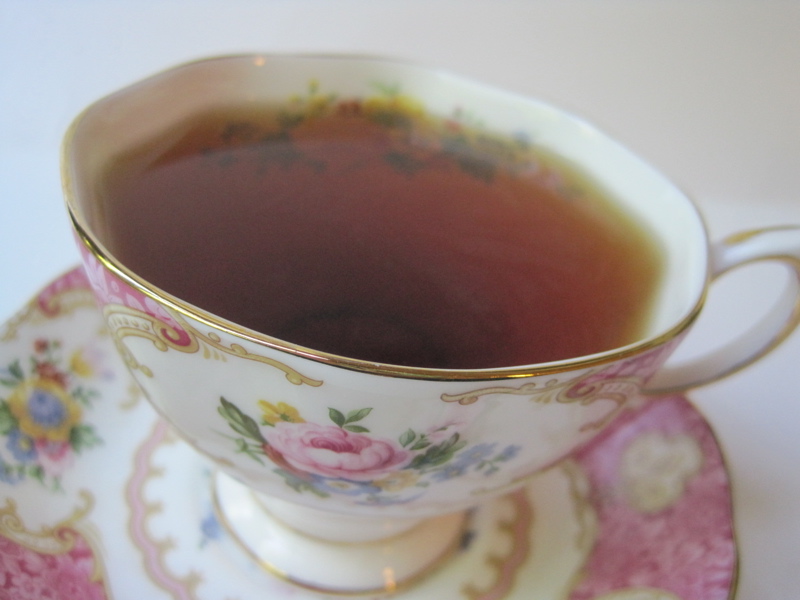
Where is `flower design`? This screenshot has width=800, height=600. flower design is located at coordinates (330, 454).